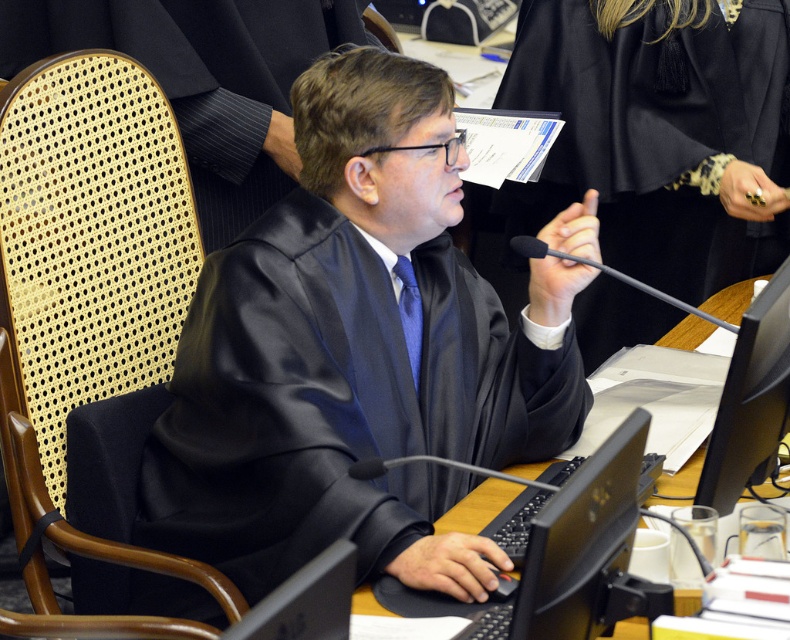
Question: Considering the real-world distances, which object is closest to the black glossy laptop at center?

Choices:
 (A) black satin robe at center
 (B) black glossy monitor at lower right
 (C) matte black robe at center
 (D) satin black robe at center

Answer: (B)

Question: Does satin black robe at center have a larger size compared to matte black robe at center?

Choices:
 (A) no
 (B) yes

Answer: (A)

Question: Does black glossy laptop at center appear on the left side of black glossy monitor at lower right?

Choices:
 (A) no
 (B) yes

Answer: (B)

Question: Does satin black robe at center have a larger size compared to matte black robe at center?

Choices:
 (A) yes
 (B) no

Answer: (B)

Question: Among these points, which one is farthest from the camera?

Choices:
 (A) (570, 540)
 (B) (140, 33)
 (C) (736, 449)
 (D) (510, 259)

Answer: (D)

Question: Among these points, which one is farthest from the camera?

Choices:
 (A) (766, 449)
 (B) (217, 108)
 (C) (589, 548)
 (D) (608, 294)

Answer: (D)